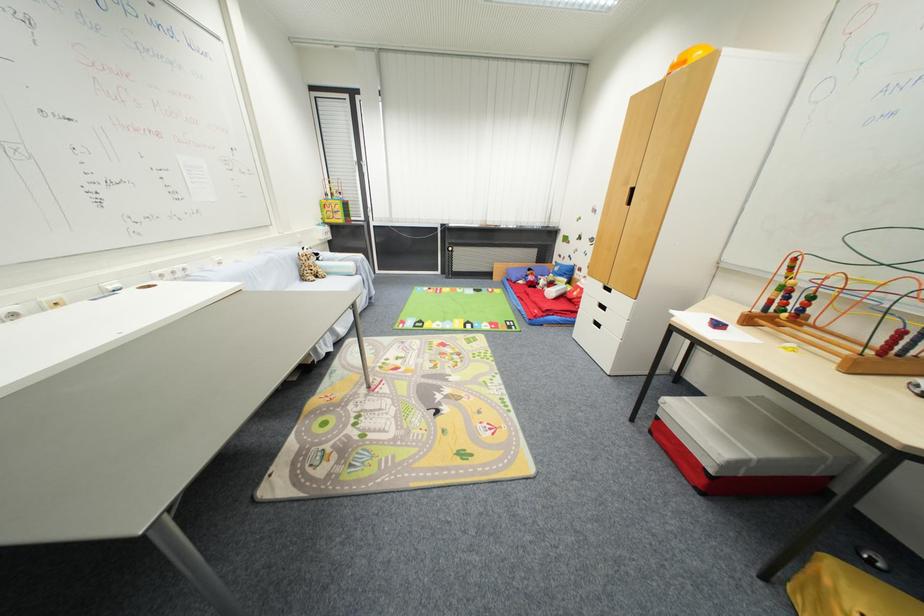
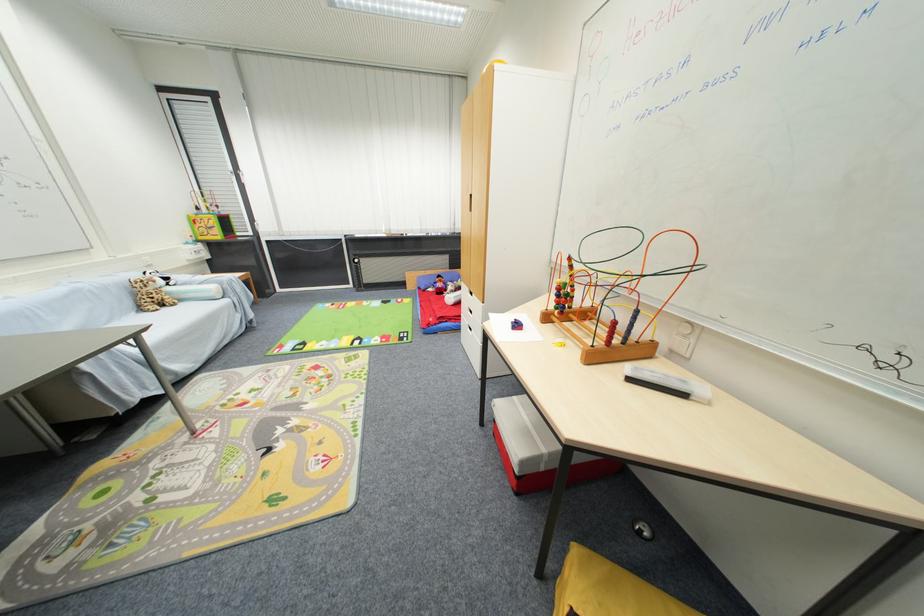
Find the pixel in the second image that matches point (800, 262) in the first image.

(575, 261)